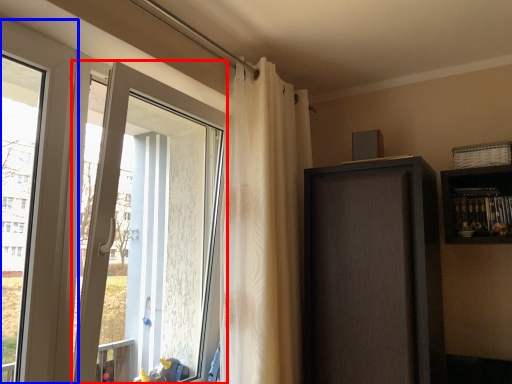
Question: Which point is further to the camera, door (highlighted by a red box) or window (highlighted by a blue box)?

Choices:
 (A) door
 (B) window

Answer: (A)